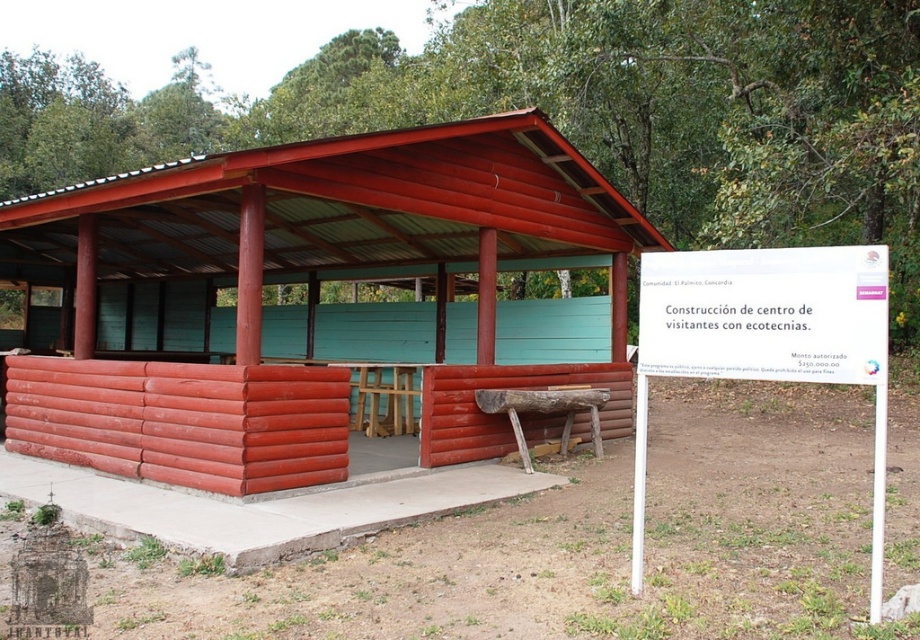
Who is more forward, (73, 348) or (542, 406)?

Point (542, 406) is in front.

This screenshot has height=640, width=920. Describe the element at coordinates (334, 252) in the screenshot. I see `matte red log cabin at center` at that location.

Who is more distant from viewer, (x=584, y=250) or (x=519, y=390)?

The point (x=584, y=250) is more distant.

Find the location of a particular element. This screenshot has height=640, width=920. matte red log cabin at center is located at coordinates (334, 252).

Is matte red log cabin at center thinner than white plastic sign at center right?

No, matte red log cabin at center is not thinner than white plastic sign at center right.

Measure the distance between matte red log cabin at center and camera.

matte red log cabin at center is 5.96 meters from camera.

What do you see at coordinates (334, 252) in the screenshot?
I see `matte red log cabin at center` at bounding box center [334, 252].

Identify the location of matte red log cabin at center. The image size is (920, 640). (334, 252).

Does white plastic sign at center right appear on the left side of wooden picnic table at center?

In fact, white plastic sign at center right is to the right of wooden picnic table at center.

Can you confirm if white plastic sign at center right is smaller than wooden picnic table at center?

Correct, white plastic sign at center right occupies less space than wooden picnic table at center.

This screenshot has height=640, width=920. I want to click on white plastic sign at center right, so click(x=765, y=339).